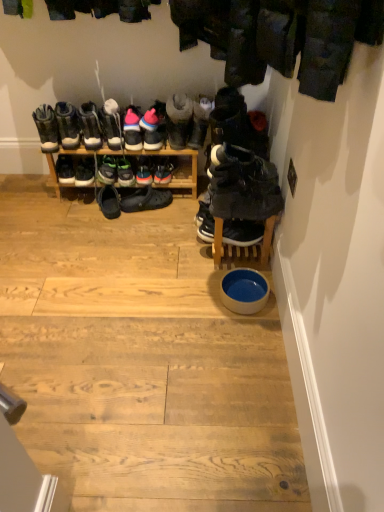
The width and height of the screenshot is (384, 512). Find the location of `pink suede sneakers at center, placed as the seventh footwear when sorted from right to left`. pink suede sneakers at center, placed as the seventh footwear when sorted from right to left is located at coordinates (152, 130).

The image size is (384, 512). Describe the element at coordinates (180, 170) in the screenshot. I see `wooden shoe rack at center` at that location.

Where is `wooden shoe rack at center`? The height and width of the screenshot is (512, 384). wooden shoe rack at center is located at coordinates (180, 170).

I want to click on suede sneakers at center, marked as the fifth footwear in a right-to-left arrangement, so click(x=178, y=120).

At what (x,y) coordinates should I click in order to perform the action: click on leather boots at center, arranged as the 4th footwear when viewed from the right. Please return your answer as a coordinate pair (x, y). The width and height of the screenshot is (384, 512). Looking at the image, I should click on (200, 121).

Is matte black boots at center, which ranks as the 14th footwear in right-to-left order, closer to the viewer compared to shiny blue sneakers at center, which is counted as the ninth footwear, starting from the left?

Yes, matte black boots at center, which ranks as the 14th footwear in right-to-left order, is closer to the camera.

Does point (95, 131) come behind point (147, 184)?

No.

Considering the relative sizes of matte black boots at center, positioned as the third footwear in left-to-right order, and shiny blue sneakers at center, which is counted as the ninth footwear, starting from the left, in the image provided, is matte black boots at center, positioned as the third footwear in left-to-right order, taller than shiny blue sneakers at center, which is counted as the ninth footwear, starting from the left,?

Indeed, matte black boots at center, positioned as the third footwear in left-to-right order, has a greater height compared to shiny blue sneakers at center, which is counted as the ninth footwear, starting from the left.

From the image's perspective, is green matte sneakers at center, the thirteenth footwear in the right-to-left sequence, located beneath leather boots at left, the 15th footwear in the right-to-left sequence?

Correct, green matte sneakers at center, the thirteenth footwear in the right-to-left sequence, appears lower than leather boots at left, the 15th footwear in the right-to-left sequence, in the image.

Between green matte sneakers at center, which is the 4th footwear in left-to-right order, and leather boots at left, the 15th footwear in the right-to-left sequence, which one has more height?

leather boots at left, the 15th footwear in the right-to-left sequence, is taller.

Are green matte sneakers at center, the thirteenth footwear in the right-to-left sequence, and leather boots at left, which ranks as the second footwear in left-to-right order, located far from each other?

Actually, green matte sneakers at center, the thirteenth footwear in the right-to-left sequence, and leather boots at left, which ranks as the second footwear in left-to-right order, are a little close together.

Does green matte sneakers at center, the thirteenth footwear in the right-to-left sequence, appear on the left side of leather boots at left, the 15th footwear in the right-to-left sequence?

No, green matte sneakers at center, the thirteenth footwear in the right-to-left sequence, is not to the left of leather boots at left, the 15th footwear in the right-to-left sequence.

Does leather boots at center, which is the thirteenth footwear in left-to-right order, lie behind black rubber shoes at center, which ranks as the 8th footwear in left-to-right order?

No.

What's the angular difference between leather boots at center, which is the thirteenth footwear in left-to-right order, and black rubber shoes at center, which is counted as the ninth footwear, starting from the right,'s facing directions?

They differ by 7 degrees in their facing directions.

Does leather boots at center, which is the thirteenth footwear in left-to-right order, appear on the right side of black rubber shoes at center, which ranks as the 8th footwear in left-to-right order?

Indeed, leather boots at center, which is the thirteenth footwear in left-to-right order, is positioned on the right side of black rubber shoes at center, which ranks as the 8th footwear in left-to-right order.

Does leather boots at center, which is the thirteenth footwear in left-to-right order, have a greater width compared to black rubber shoes at center, which ranks as the 8th footwear in left-to-right order?

Yes, leather boots at center, which is the thirteenth footwear in left-to-right order, is wider than black rubber shoes at center, which ranks as the 8th footwear in left-to-right order.

Can you confirm if blue ceramic bowl at center is shorter than white glossy bowl at center?

In fact, blue ceramic bowl at center may be taller than white glossy bowl at center.

Consider the image. Based on their positions, is blue ceramic bowl at center located to the left or right of white glossy bowl at center?

blue ceramic bowl at center is to the right of white glossy bowl at center.

Identify the location of stair in front of the blue ceramic bowl at center. point(158,411).

Considering the relative sizes of blue ceramic bowl at center and white glossy bowl at center in the image provided, is blue ceramic bowl at center bigger than white glossy bowl at center?

Incorrect, blue ceramic bowl at center is not larger than white glossy bowl at center.

Is leather boots at center, arranged as the 4th footwear when viewed from the right, turned away from green matte sneakers at center, which is the 4th footwear in left-to-right order?

leather boots at center, arranged as the 4th footwear when viewed from the right, does not have its back to green matte sneakers at center, which is the 4th footwear in left-to-right order.

Is leather boots at center, which is the thirteenth footwear in left-to-right order, far from green matte sneakers at center, the thirteenth footwear in the right-to-left sequence?

No, leather boots at center, which is the thirteenth footwear in left-to-right order, is not far away from green matte sneakers at center, the thirteenth footwear in the right-to-left sequence.

Is leather boots at center, which is the thirteenth footwear in left-to-right order, inside the boundaries of green matte sneakers at center, which is the 4th footwear in left-to-right order, or outside?

leather boots at center, which is the thirteenth footwear in left-to-right order, is not enclosed by green matte sneakers at center, which is the 4th footwear in left-to-right order.

Image resolution: width=384 pixels, height=512 pixels. What are the coordinates of `footwear that is the 1st one when counting downward from the wooden shoe rack at center (from the image's perspective)` in the screenshot? It's located at (144, 170).

From a real-world perspective, who is located higher, wooden shoe rack at center or shiny blue sneakers at center, which is counted as the ninth footwear, starting from the left?

In real-world perspective, shiny blue sneakers at center, which is counted as the ninth footwear, starting from the left, is above.

Considering the positions of objects wooden shoe rack at center and shiny blue sneakers at center, which is counted as the ninth footwear, starting from the left, in the image provided, who is more to the left, wooden shoe rack at center or shiny blue sneakers at center, which is counted as the ninth footwear, starting from the left,?

wooden shoe rack at center.

Considering the sizes of pink suede sneakers at center, placed as the seventh footwear when sorted from right to left, and green suede sneakers at center, acting as the 6th footwear starting from the left, in the image, is pink suede sneakers at center, placed as the seventh footwear when sorted from right to left, wider or thinner than green suede sneakers at center, acting as the 6th footwear starting from the left,?

Clearly, pink suede sneakers at center, placed as the seventh footwear when sorted from right to left, has more width compared to green suede sneakers at center, acting as the 6th footwear starting from the left.

Considering the sizes of objects pink suede sneakers at center, the 10th footwear from the left, and green suede sneakers at center, the eleventh footwear viewed from the right, in the image provided, who is bigger, pink suede sneakers at center, the 10th footwear from the left, or green suede sneakers at center, the eleventh footwear viewed from the right,?

pink suede sneakers at center, the 10th footwear from the left, is bigger.

In the scene shown: Is pink suede sneakers at center, placed as the seventh footwear when sorted from right to left, not within green suede sneakers at center, acting as the 6th footwear starting from the left?

That's correct, pink suede sneakers at center, placed as the seventh footwear when sorted from right to left, is outside of green suede sneakers at center, acting as the 6th footwear starting from the left.

What are the coordinates of `the 2nd footwear in front of the green suede sneakers at center, the eleventh footwear viewed from the right, counting from the anchor's position` in the screenshot? It's located at (152, 130).

You are a GUI agent. You are given a task and a screenshot of the screen. Output one action in this format:
    pyautogui.click(x=<x>, y=<y>)
    Task: Click on the 7th footwear positioned above the shiny blue sneakers at center, which is counted as the 8th footwear, starting from the right (from the image's perspective)
    This screenshot has height=512, width=384.
    Given the screenshot: What is the action you would take?
    pyautogui.click(x=90, y=126)

Starting from the leather boots at left, the 15th footwear in the right-to-left sequence, which footwear is the 9th one behind? Please provide its 2D coordinates.

[(107, 170)]

Estimate the real-world distances between objects in this image. Which object is further from wooden shoe rack at center, black rubber shoes at center, which is counted as the ninth footwear, starting from the right, or pink suede sneakers at center, the 6th footwear from the right?

pink suede sneakers at center, the 6th footwear from the right, is positioned further to the anchor wooden shoe rack at center.

Based on their spatial positions, is pink suede sneakers at center, which is the seventh footwear from left to right, or pink suede sneakers at center, arranged as the 11th footwear when viewed from the left, further from blue ceramic bowl at center?

pink suede sneakers at center, which is the seventh footwear from left to right.

When comparing their distances from pink suede sneakers at center, which is the seventh footwear from left to right, does wooden shoe rack at center or pink suede sneakers at center, the 6th footwear from the right, seem further?

Among the two, wooden shoe rack at center is located further to pink suede sneakers at center, which is the seventh footwear from left to right.

Based on the photo, estimate the real-world distances between objects in this image. Which object is further from shiny blue sneakers at center, which is counted as the 8th footwear, starting from the right, green suede sneakers at center, the eleventh footwear viewed from the right, or suede sneakers at center, marked as the fifth footwear in a right-to-left arrangement?

suede sneakers at center, marked as the fifth footwear in a right-to-left arrangement, is further to shiny blue sneakers at center, which is counted as the 8th footwear, starting from the right.

Which object lies further to the anchor point white glossy bowl at center, matte black boot at left, positioned as the sixteenth footwear in right-to-left order, or wooden shoe rack at center?

Based on the image, matte black boot at left, positioned as the sixteenth footwear in right-to-left order, appears to be further to white glossy bowl at center.

Estimate the real-world distances between objects in this image. Which object is further from matte black boots at center, positioned as the third footwear in left-to-right order, pink suede sneakers at center, arranged as the 11th footwear when viewed from the left, or leather boots at center, which is the thirteenth footwear in left-to-right order?

leather boots at center, which is the thirteenth footwear in left-to-right order, lies further to matte black boots at center, positioned as the third footwear in left-to-right order, than the other object.

When comparing their distances from suede sneakers at center, marked as the fifth footwear in a right-to-left arrangement, does pink suede sneakers at center, the 10th footwear from the left, or black rubber shoes at center, which ranks as the 8th footwear in left-to-right order, seem closer?

Based on the image, pink suede sneakers at center, the 10th footwear from the left, appears to be nearer to suede sneakers at center, marked as the fifth footwear in a right-to-left arrangement.

From the image, which object appears to be farther from pink suede sneakers at center, arranged as the 11th footwear when viewed from the left, wooden shoe rack at center or leather boots at left, which ranks as the second footwear in left-to-right order?

leather boots at left, which ranks as the second footwear in left-to-right order, lies further to pink suede sneakers at center, arranged as the 11th footwear when viewed from the left, than the other object.

This screenshot has width=384, height=512. I want to click on bowl between white glossy bowl at center and shiny blue sneakers at center, which is counted as the ninth footwear, starting from the left, in the front-back direction, so [x=244, y=291].

Image resolution: width=384 pixels, height=512 pixels. What are the coordinates of `shelf between white suede sneakers at center, the 12th footwear in the right-to-left sequence, and pink suede sneakers at center, arranged as the 11th footwear when viewed from the left` in the screenshot? It's located at point(180,170).

I want to click on shelf located between matte black boot at left, positioned as the sixteenth footwear in right-to-left order, and black suede sneakers at center, which is the sixteenth footwear in left-to-right order, in the left-right direction, so click(180, 170).

The height and width of the screenshot is (512, 384). I want to click on shelf between matte black boot at left, positioned as the sixteenth footwear in right-to-left order, and shiny blue sneakers at center, which is counted as the 8th footwear, starting from the right, so click(180, 170).